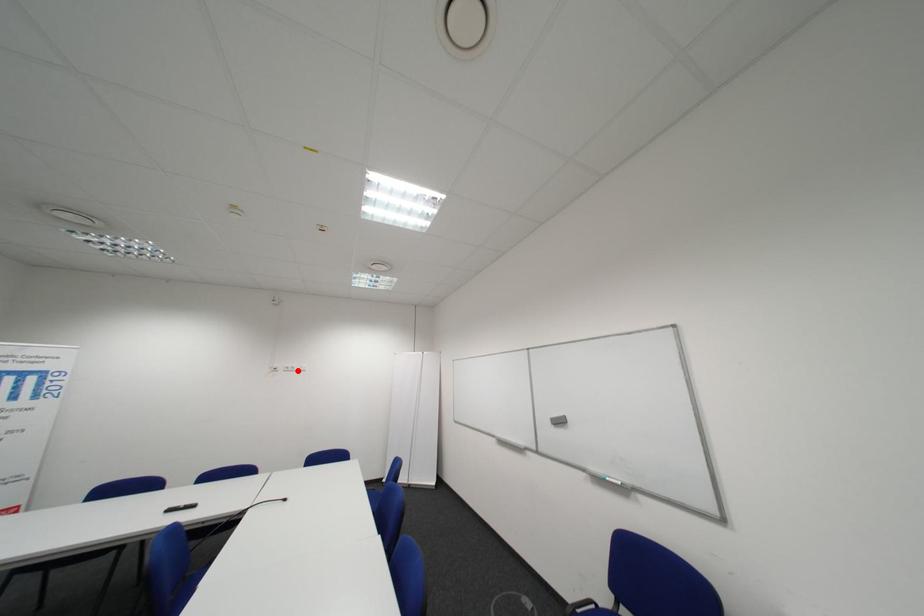
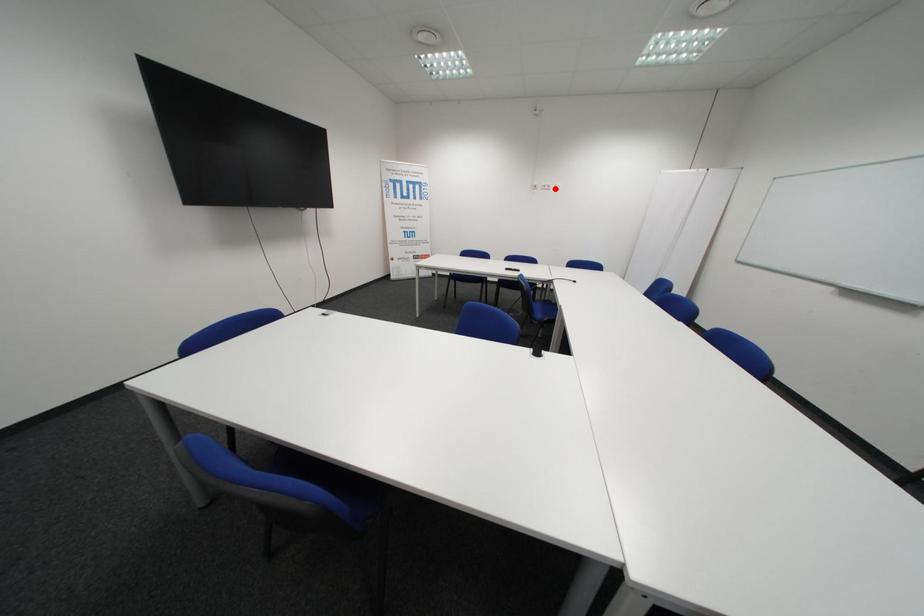
I am providing you with two images of the same scene from different viewpoints. A red point is marked on the first image and another point is marked on the second image. Does the point marked in image1 correspond to the same location as the one in image2?

Yes